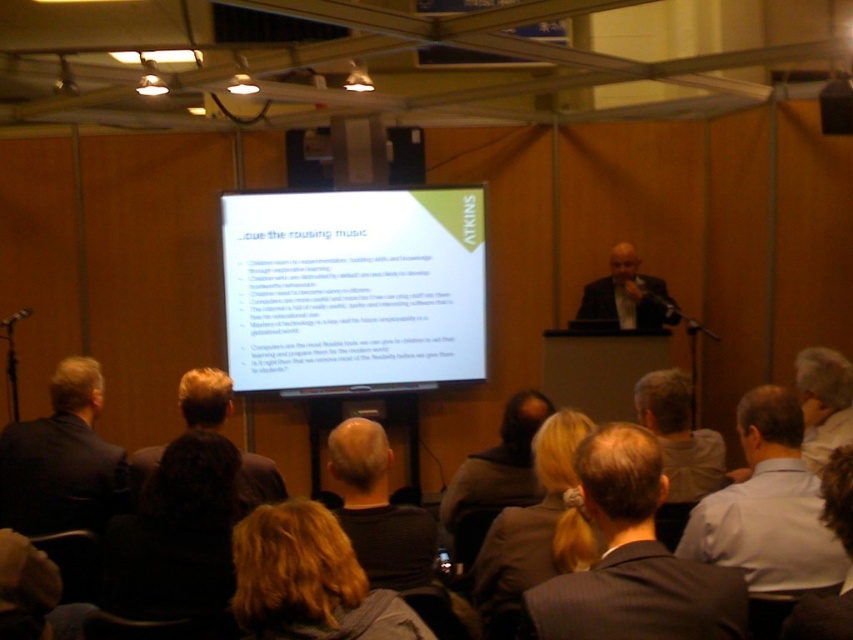
Is point (744, 595) farther from viewer compared to point (138, 461)?

No.

Is dark brown suit at center below dark brown hair at center?

No, dark brown suit at center is not below dark brown hair at center.

The width and height of the screenshot is (853, 640). What do you see at coordinates (633, 557) in the screenshot? I see `dark brown suit at center` at bounding box center [633, 557].

The height and width of the screenshot is (640, 853). Identify the location of dark brown suit at center. (633, 557).

Is point (550, 508) in front of point (345, 492)?

Yes, point (550, 508) is closer to viewer.

From the picture: Does blonde hair at upper center have a smaller size compared to blonde hair at center?

Incorrect, blonde hair at upper center is not smaller in size than blonde hair at center.

I want to click on blonde hair at upper center, so click(534, 531).

Identify the location of blonde hair at upper center. The height and width of the screenshot is (640, 853). (534, 531).

Which of these two, blonde hair at center or dark suit at center, stands taller?

dark suit at center

Does point (329, 433) come farther from viewer compared to point (604, 320)?

Yes, it is behind point (604, 320).

Identify the location of blonde hair at center. The height and width of the screenshot is (640, 853). (378, 509).